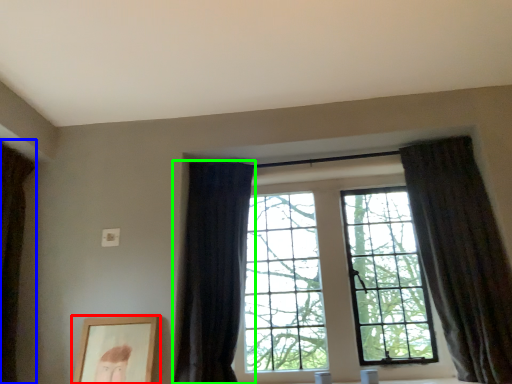
Question: Considering the real-world distances, which object is farthest from picture frame (highlighted by a red box)? curtain (highlighted by a blue box) or curtain (highlighted by a green box)?

Choices:
 (A) curtain
 (B) curtain

Answer: (A)